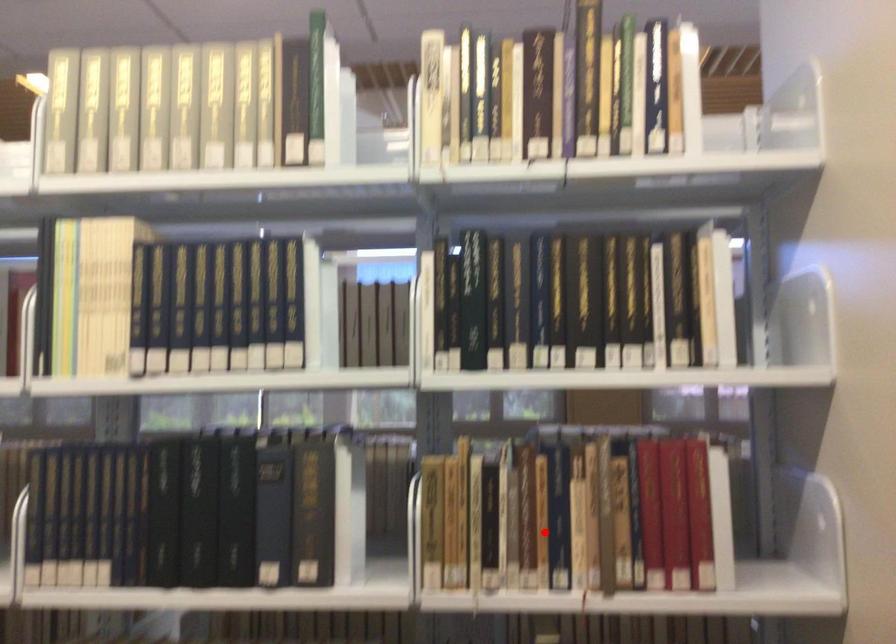
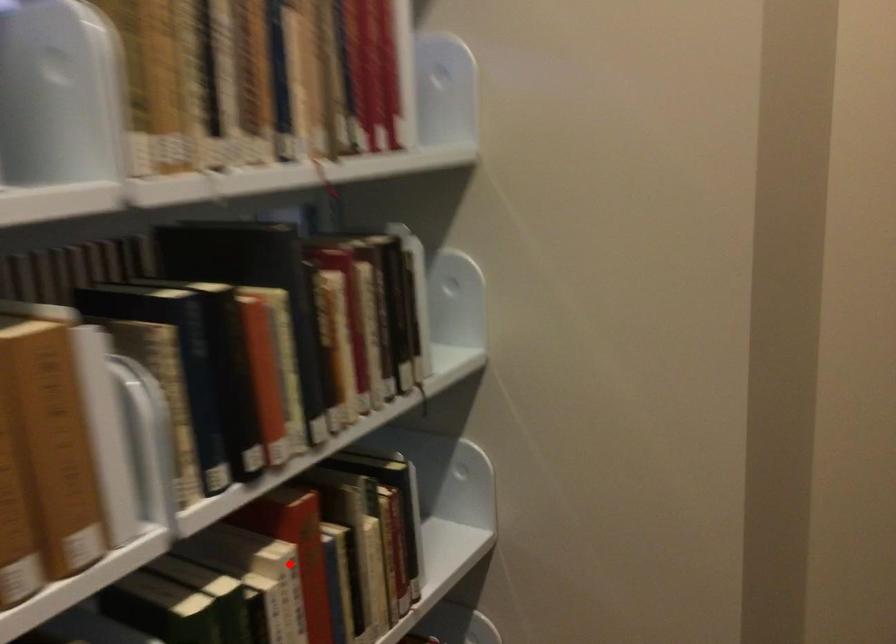
I am providing you with two images of the same scene from different viewpoints. A red point is marked on the first image and another point is marked on the second image. Do the highlighted points in image1 and image2 indicate the same real-world spot?

No